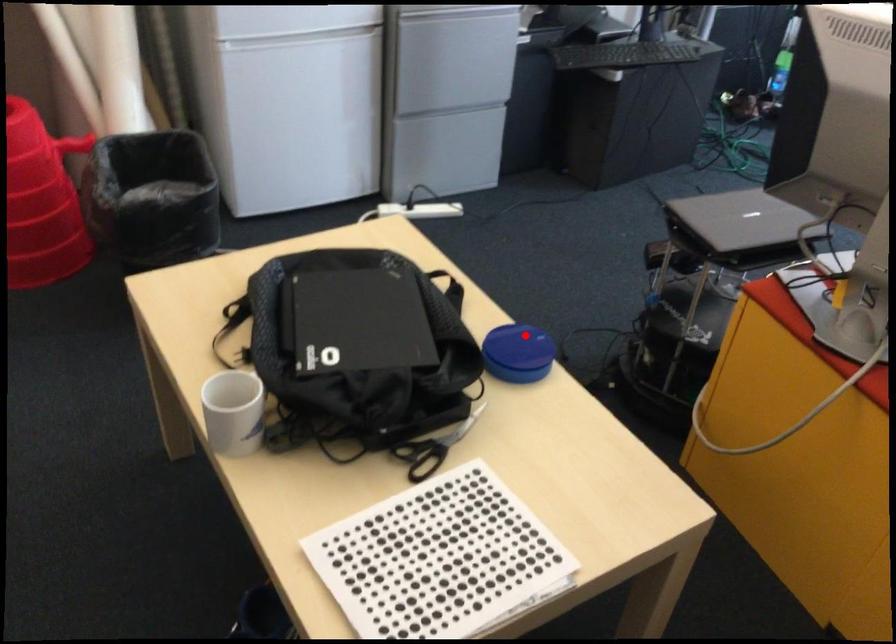
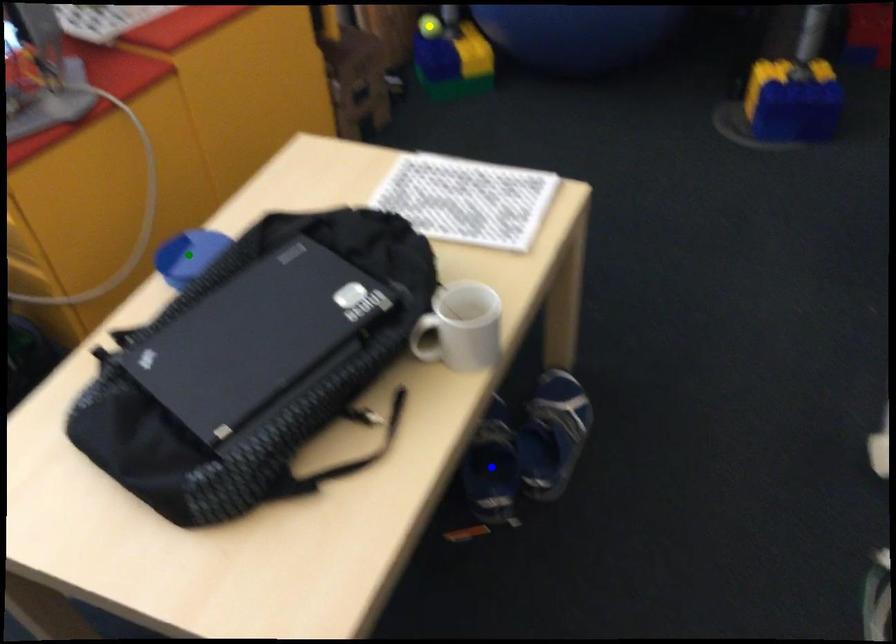
Question: I am providing you with two images of the same scene from different viewpoints. A red point is marked on the first image. You are given multiple points on the second image. Which spot in image 2 lines up with the point in image 1?

Choices:
 (A) yellow point
 (B) green point
 (C) blue point

Answer: (B)